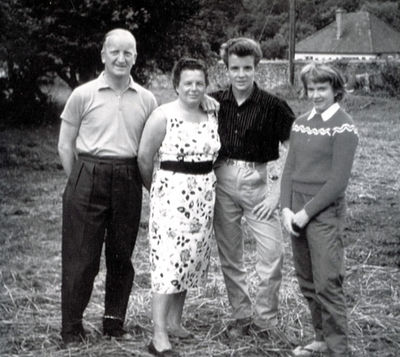
Locate an element on the screen. This screenshot has width=400, height=357. chimney is located at coordinates (340, 31).